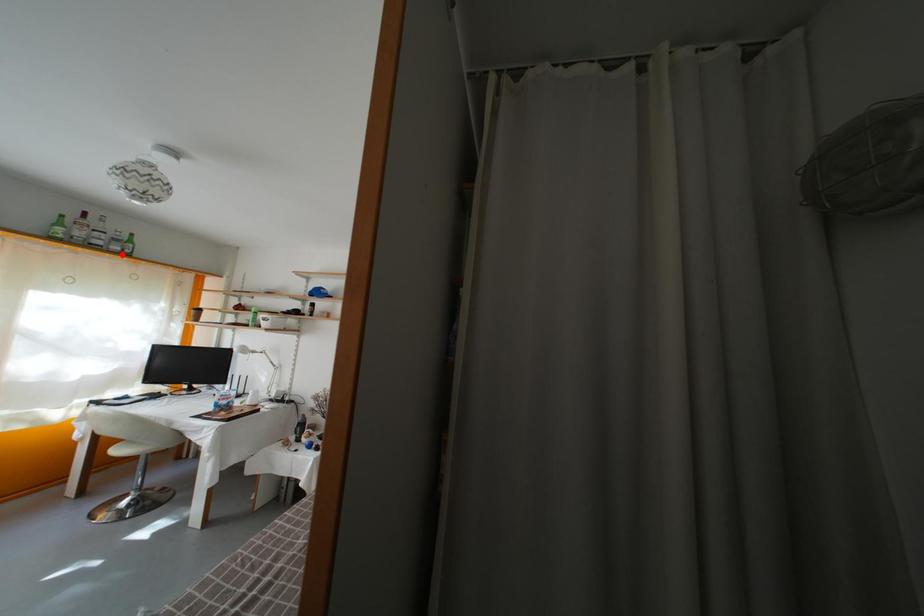
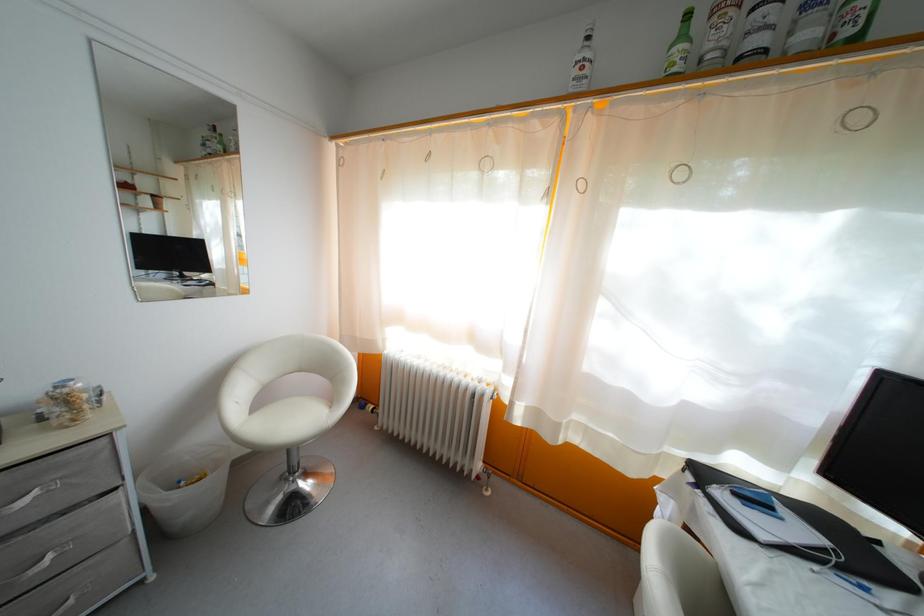
Find the pixel in the second image that matches the highlighted location in the first image.

(812, 42)